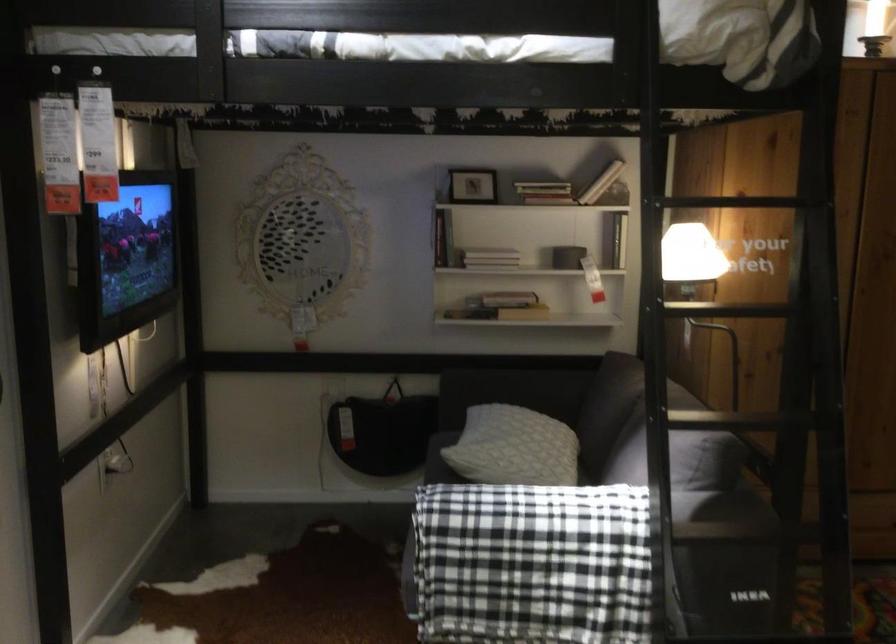
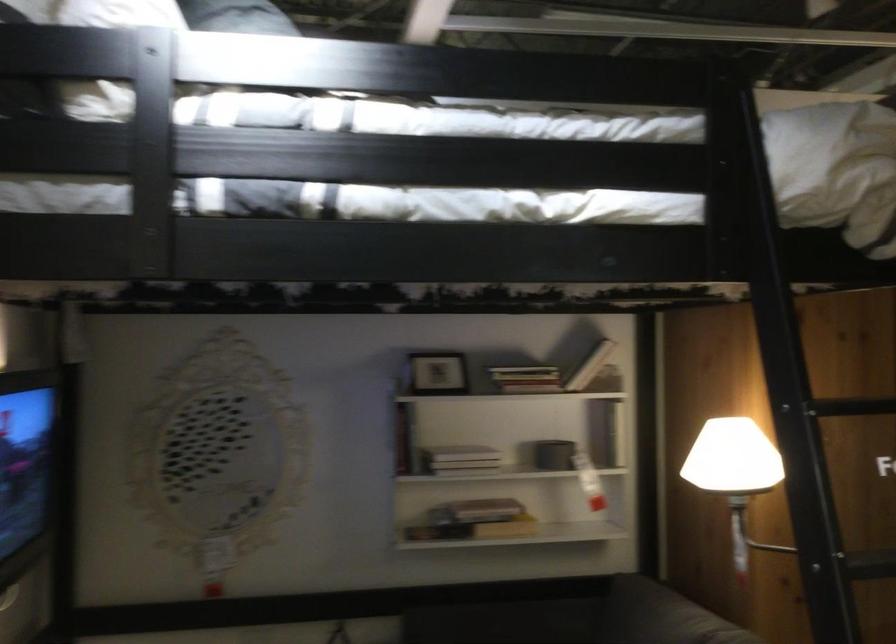
In the second image, find the point that corresponds to point (570, 247) in the first image.

(553, 453)